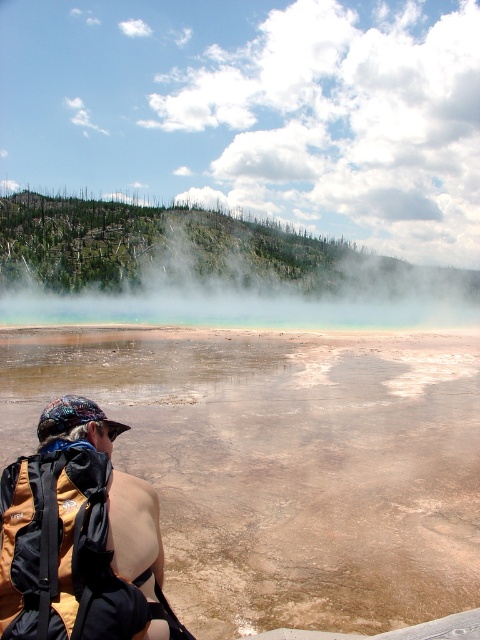
Between brown sedimentary water at center and brown fabric backpack at lower left, which one is positioned lower?

brown sedimentary water at center

Can you confirm if brown sedimentary water at center is wider than brown fabric backpack at lower left?

Correct, the width of brown sedimentary water at center exceeds that of brown fabric backpack at lower left.

Locate an element on the screen. The width and height of the screenshot is (480, 640). brown sedimentary water at center is located at coordinates (283, 464).

Who is more distant from viewer, (309,296) or (113,547)?

Positioned behind is point (309,296).

Measure the distance between point [255,296] and camera.

The distance of point [255,296] from camera is 108.37 meters.

Between point (140, 284) and point (109, 600), which one is positioned behind?

The point (140, 284) is behind.

Locate an element on the screen. The width and height of the screenshot is (480, 640). white misty steam at upper center is located at coordinates (205, 269).

Can you confirm if brown sedimentary water at center is positioned to the left of white misty steam at upper center?

Yes, brown sedimentary water at center is to the left of white misty steam at upper center.

Can you confirm if brown sedimentary water at center is thinner than white misty steam at upper center?

Indeed, brown sedimentary water at center has a lesser width compared to white misty steam at upper center.

Which is behind, point (368, 333) or point (358, 294)?

The point (358, 294) is more distant.

Where is `brown sedimentary water at center`? This screenshot has width=480, height=640. brown sedimentary water at center is located at coordinates (283, 464).